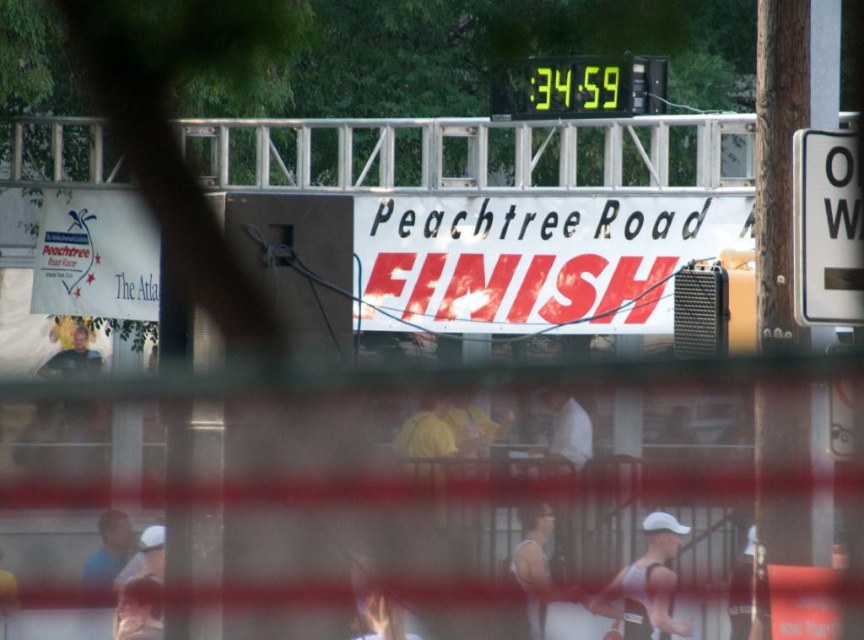
Question: Does white fabric at center have a greater width compared to white fabric shirt at lower left?

Choices:
 (A) no
 (B) yes

Answer: (B)

Question: Does yellow digital clock at upper center lie in front of white matte tank top at center?

Choices:
 (A) yes
 (B) no

Answer: (B)

Question: Among these objects, which one is farthest from the camera?

Choices:
 (A) white fabric shirt at lower left
 (B) white paper sign at center
 (C) white matte tank top at center

Answer: (B)

Question: Based on their relative distances, which object is nearer to the yellow digital clock at upper center?

Choices:
 (A) white matte tank top at center
 (B) white fabric shirt at lower left

Answer: (B)

Question: Does white athletic tank top at lower right appear under blue fabric shirt at lower left?

Choices:
 (A) no
 (B) yes

Answer: (B)

Question: Which object appears closest to the camera in this image?

Choices:
 (A) white plastic one-way sign at right
 (B) white paper sign at center

Answer: (A)